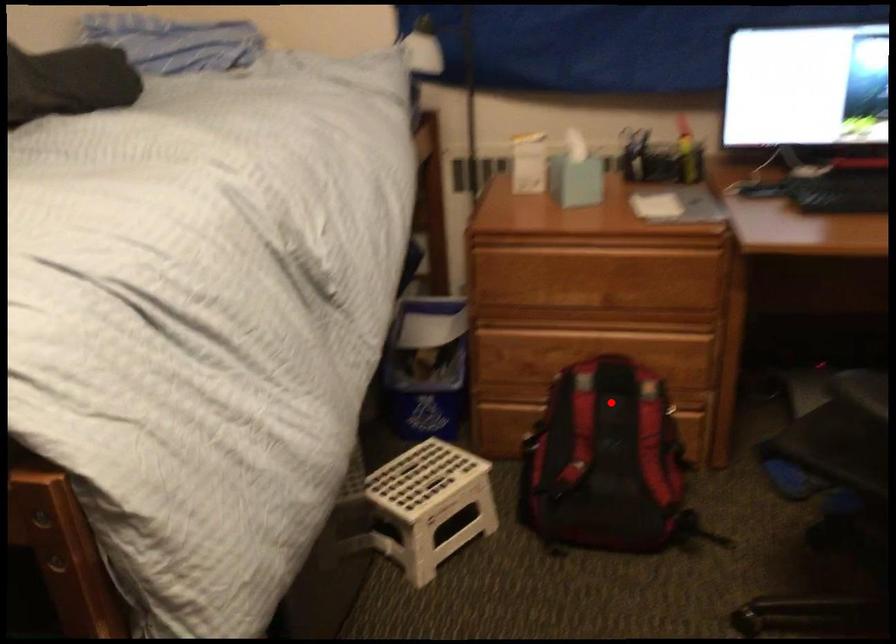
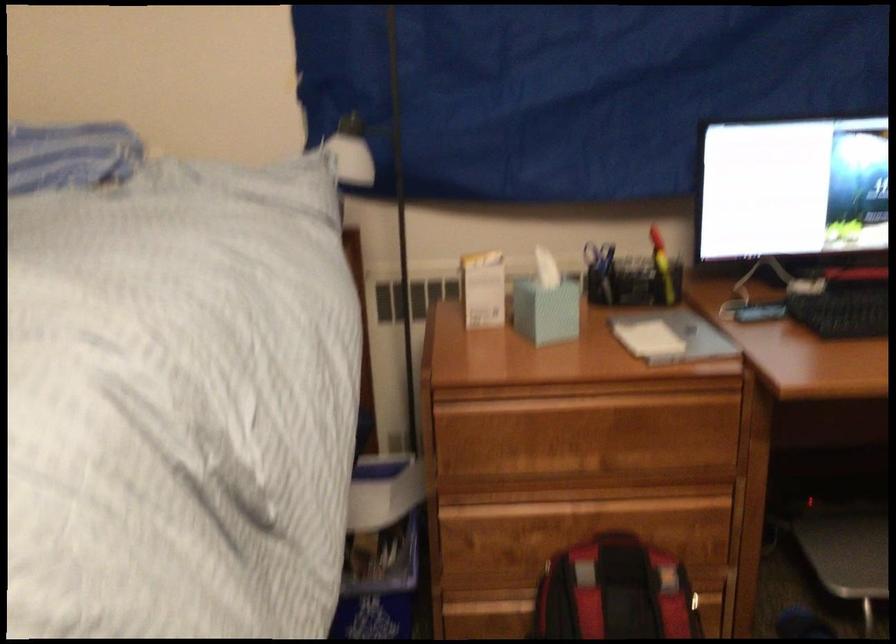
Question: I am providing you with two images of the same scene from different viewpoints. In image1, a red point is highlighted. Considering the same 3D point in image2, which of the following is correct?

Choices:
 (A) It is closer
 (B) It is farther

Answer: (A)